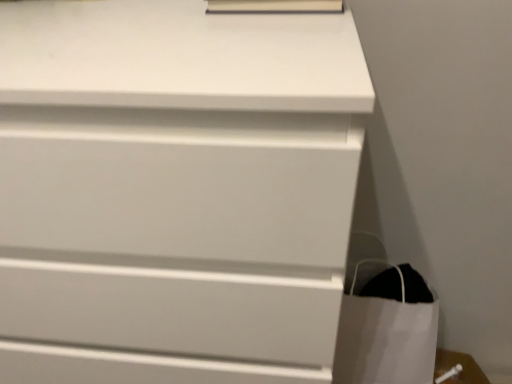
Question: Considering the positions of white paper bag at lower right and matte white book at upper center in the image, is white paper bag at lower right bigger or smaller than matte white book at upper center?

Choices:
 (A) big
 (B) small

Answer: (A)

Question: Is white paper bag at lower right in front of or behind matte white book at upper center in the image?

Choices:
 (A) front
 (B) behind

Answer: (B)

Question: Which object is positioned closest to the white paper bag at lower right?

Choices:
 (A) white matte chest of drawers at center
 (B) matte white book at upper center

Answer: (A)

Question: Estimate the real-world distances between objects in this image. Which object is farther from the white matte chest of drawers at center?

Choices:
 (A) matte white book at upper center
 (B) white paper bag at lower right

Answer: (B)